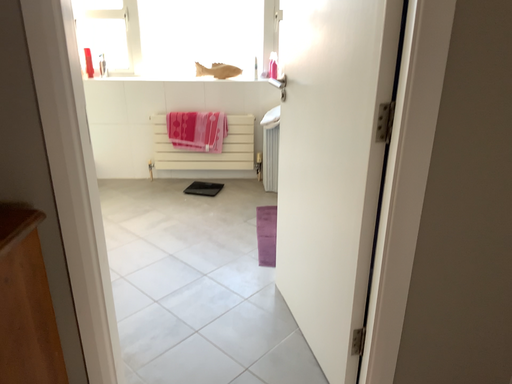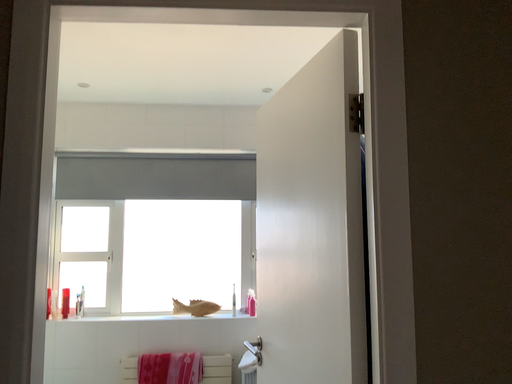
Question: How did the camera likely rotate when shooting the video?

Choices:
 (A) rotated downward
 (B) rotated upward

Answer: (B)